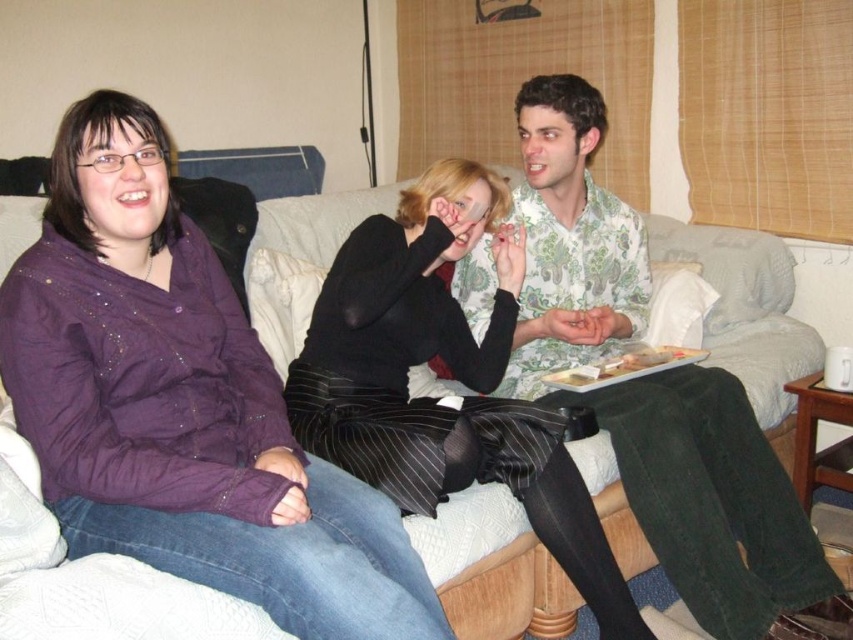
You are a delivery robot that needs to place a small package between the black pinstripe pants at center and the white fabric couch at upper left. The package requires 40 inches of space. Can you fit it there?

The distance between the black pinstripe pants at center and the white fabric couch at upper left is 38.16 inches, which is less than the required 40 inches. Therefore, the package cannot be placed there.

You are organizing a clothing donation drive and need to determine if the floral cotton shirt at center and the black pinstripe pants at center can fit into a standard donation box that has a maximum capacity of 3 cubic feet. Given their sizes, will both items fit together?

The floral cotton shirt at center is bigger than the black pinstripe pants at center. However, without specific size measurements, it is impossible to determine if both items can fit into the donation box together. More information about their exact dimensions is needed.

You are a photographer standing at the camera position. You want to take a closeup shot of the floral cotton shirt at center. What should you do to ensure the shirt is in focus?

To ensure the floral cotton shirt at center is in focus, move closer to it since it is 1.72 meters away from the camera. Adjust your camera settings for proper focus at that distance.